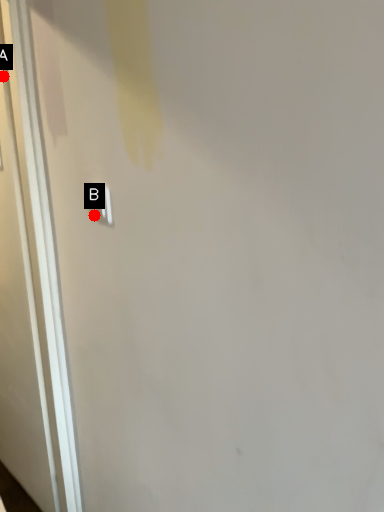
Question: Two points are circled on the image, labeled by A and B beside each circle. Which point appears farthest from the camera in this image?

Choices:
 (A) A is further
 (B) B is further

Answer: (A)